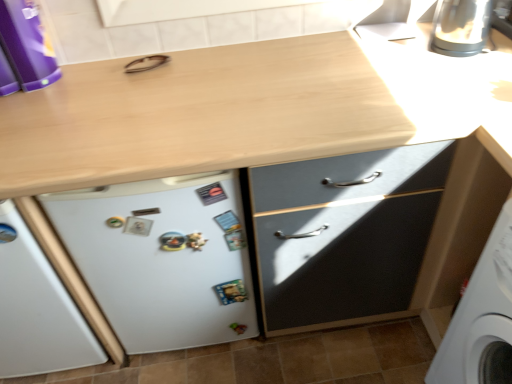
Question: Does satin silver kettle at upper right appear on the left side of white matte refrigerator at lower left?

Choices:
 (A) no
 (B) yes

Answer: (A)

Question: Is satin silver kettle at upper right positioned with its back to white matte refrigerator at lower left?

Choices:
 (A) no
 (B) yes

Answer: (A)

Question: From the image's perspective, does satin silver kettle at upper right appear higher than white matte refrigerator at lower left?

Choices:
 (A) no
 (B) yes

Answer: (B)

Question: Does satin silver kettle at upper right have a greater width compared to white matte refrigerator at lower left?

Choices:
 (A) no
 (B) yes

Answer: (B)

Question: Could you tell me if satin silver kettle at upper right is facing white matte refrigerator at lower left?

Choices:
 (A) yes
 (B) no

Answer: (B)

Question: Is white matte refrigerator at lower left surrounded by satin silver kettle at upper right?

Choices:
 (A) no
 (B) yes

Answer: (A)

Question: Considering the relative sizes of white matte refrigerator at lower left and satin silver kettle at upper right in the image provided, is white matte refrigerator at lower left taller than satin silver kettle at upper right?

Choices:
 (A) yes
 (B) no

Answer: (A)

Question: From the image's perspective, does white matte refrigerator at lower left appear higher than satin silver kettle at upper right?

Choices:
 (A) yes
 (B) no

Answer: (B)

Question: Considering the relative positions of white matte refrigerator at lower left and satin silver kettle at upper right in the image provided, is white matte refrigerator at lower left to the left of satin silver kettle at upper right from the viewer's perspective?

Choices:
 (A) no
 (B) yes

Answer: (B)

Question: Is white matte refrigerator at lower left facing towards satin silver kettle at upper right?

Choices:
 (A) no
 (B) yes

Answer: (A)

Question: Is satin silver kettle at upper right surrounded by white matte refrigerator at lower left?

Choices:
 (A) yes
 (B) no

Answer: (B)

Question: Is the depth of white matte refrigerator at lower left greater than that of satin silver kettle at upper right?

Choices:
 (A) yes
 (B) no

Answer: (B)

Question: Is satin silver kettle at upper right aimed at purple plastic container at upper left?

Choices:
 (A) no
 (B) yes

Answer: (A)